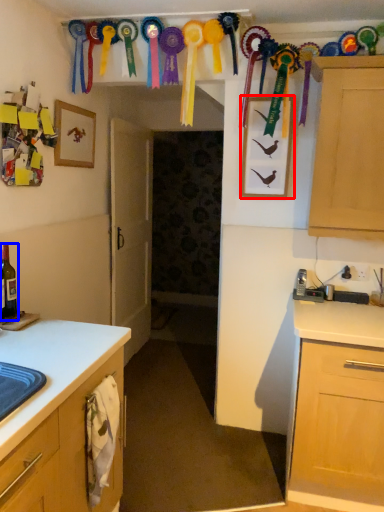
Question: Which object is closer to the camera taking this photo, picture frame (highlighted by a red box) or beer bottle (highlighted by a blue box)?

Choices:
 (A) picture frame
 (B) beer bottle

Answer: (B)